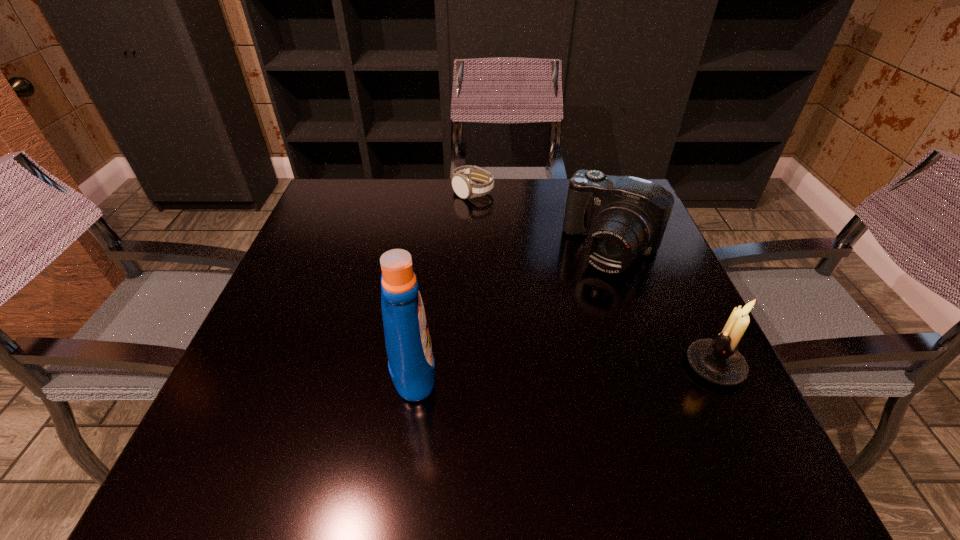
Where is `vacant space located 0.210m on the face of the third object from right to left`? The width and height of the screenshot is (960, 540). vacant space located 0.210m on the face of the third object from right to left is located at coordinates (490, 249).

Image resolution: width=960 pixels, height=540 pixels. I want to click on vacant space located 0.250m on the lens of the third nearest object, so click(549, 353).

At what (x,y) coordinates should I click in order to perform the action: click on free space located on the lens of the third nearest object. Please return your answer as a coordinate pair (x, y). Looking at the image, I should click on (522, 395).

The width and height of the screenshot is (960, 540). Identify the location of free spot located 0.210m on the lens of the third nearest object. (558, 339).

Where is `watch situated at the far edge`? watch situated at the far edge is located at coordinates (463, 186).

Locate an element on the screen. The width and height of the screenshot is (960, 540). camera that is at the far edge is located at coordinates (622, 216).

This screenshot has height=540, width=960. What are the coordinates of `detergent that is at the near edge` in the screenshot? It's located at (411, 364).

Where is `candle holder that is at the near edge`? The image size is (960, 540). candle holder that is at the near edge is located at coordinates (718, 360).

This screenshot has height=540, width=960. What are the coordinates of `candle holder at the right edge` in the screenshot? It's located at (718, 360).

At what (x,y) coordinates should I click in order to perform the action: click on camera located in the right edge section of the desktop. Please return your answer as a coordinate pair (x, y). This screenshot has height=540, width=960. Looking at the image, I should click on (622, 216).